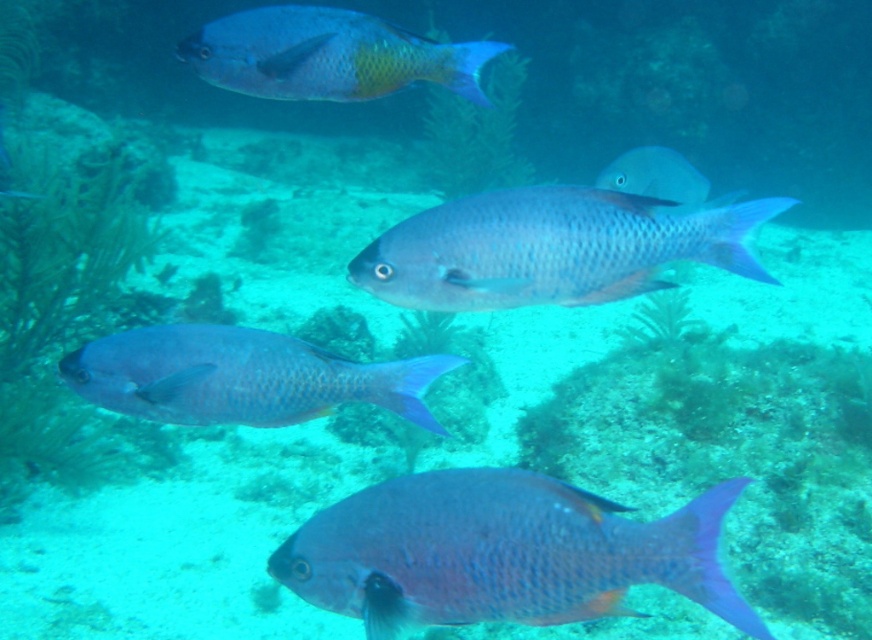
Image resolution: width=872 pixels, height=640 pixels. Find the location of `satin blue fish at center`. satin blue fish at center is located at coordinates (550, 248).

Does point (441, 248) lie behind point (239, 48)?

No, it is not.

The image size is (872, 640). Identify the location of satin blue fish at center. (550, 248).

Can you confirm if satin blue fish at center is positioned to the right of satin blue fish at lower left?

Correct, you'll find satin blue fish at center to the right of satin blue fish at lower left.

Find the location of `satin blue fish at center`. satin blue fish at center is located at coordinates (550, 248).

This screenshot has width=872, height=640. What do you see at coordinates (502, 552) in the screenshot?
I see `matte blue fish at center` at bounding box center [502, 552].

How far apart are matte blue fish at center and shiny blue fish at upper center?

A distance of 32.51 inches exists between matte blue fish at center and shiny blue fish at upper center.

Does point (336, 536) come closer to viewer compared to point (312, 96)?

Yes, point (336, 536) is closer to viewer.

You are a GUI agent. You are given a task and a screenshot of the screen. Output one action in this format:
    pyautogui.click(x=<x>, y=<y>)
    Task: Click on the matte blue fish at center
    The height and width of the screenshot is (640, 872).
    Given the screenshot: What is the action you would take?
    pyautogui.click(x=502, y=552)